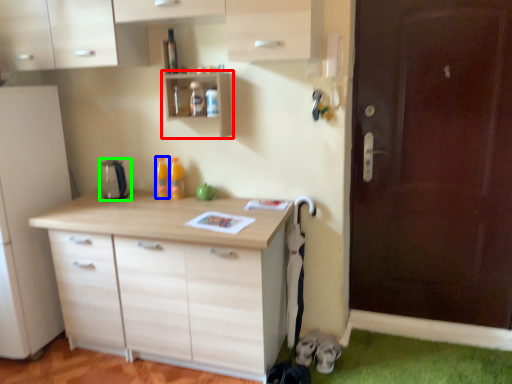
Question: Which object is the closest to the shelf (highlighted by a red box)? Choose among these: bottle (highlighted by a blue box) or appliance (highlighted by a green box).

Choices:
 (A) bottle
 (B) appliance

Answer: (A)